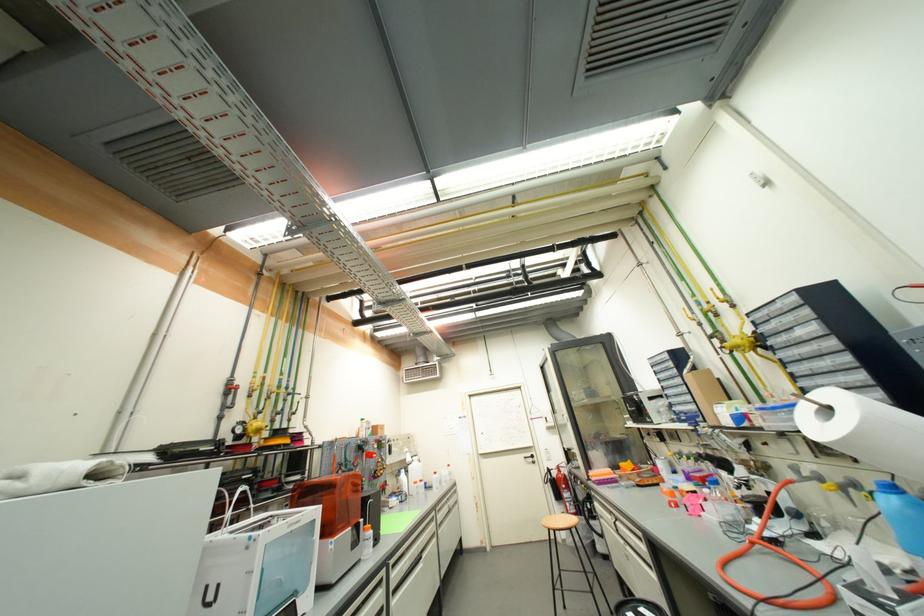
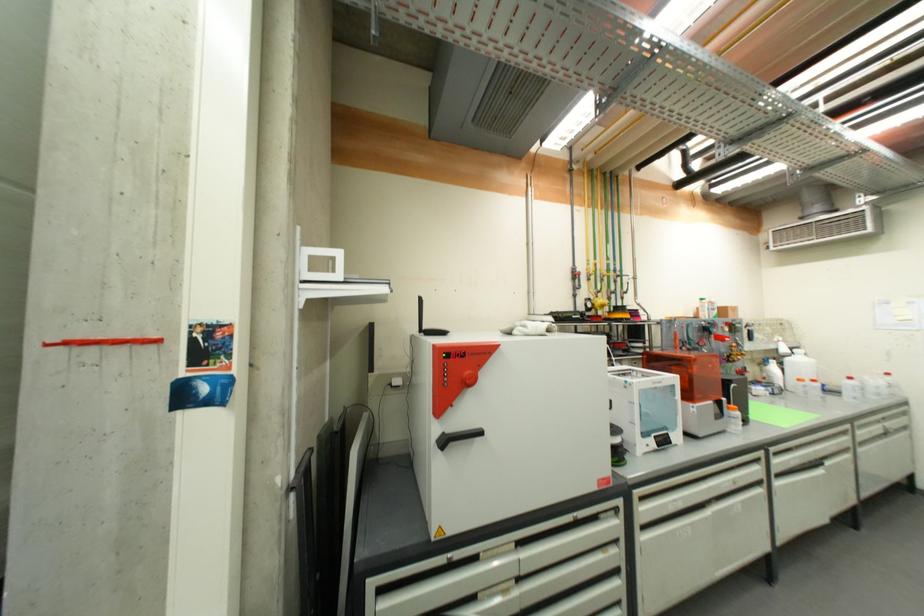
Where in the second image is the point corresponding to the point at 444,525 from the first image?

(864, 442)